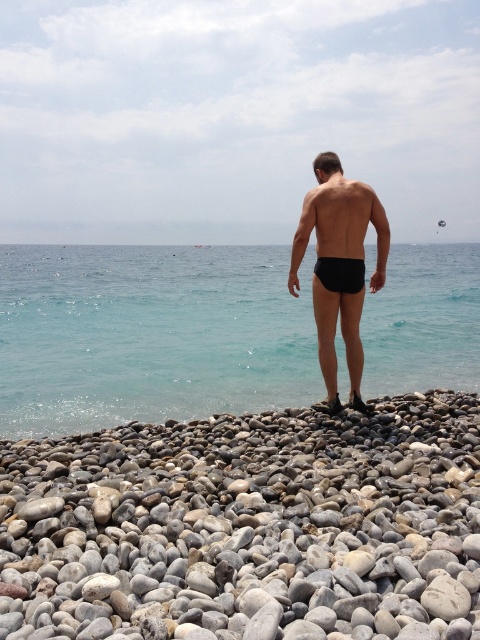
Question: Can you confirm if clear blue water at center is smaller than black matte shorts at center?

Choices:
 (A) no
 (B) yes

Answer: (A)

Question: Considering the relative positions of smooth gray pebble at center and clear blue water at center in the image provided, where is smooth gray pebble at center located with respect to clear blue water at center?

Choices:
 (A) above
 (B) below

Answer: (B)

Question: Which point appears closest to the camera in this image?

Choices:
 (A) (345, 179)
 (B) (375, 392)

Answer: (A)

Question: Among these objects, which one is farthest from the camera?

Choices:
 (A) clear blue water at center
 (B) smooth gray pebble at center

Answer: (A)

Question: Which point is closer to the camera taking this photo?

Choices:
 (A) (110, 356)
 (B) (330, 316)

Answer: (B)

Question: Is smooth gray pebble at center to the right of clear blue water at center from the viewer's perspective?

Choices:
 (A) yes
 (B) no

Answer: (B)